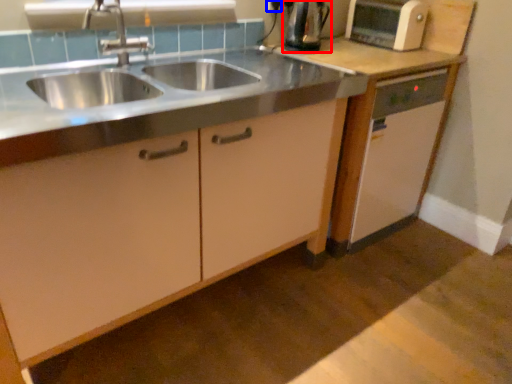
Question: Which point is further to the camera, kitchen appliance (highlighted by a red box) or electric outlet (highlighted by a blue box)?

Choices:
 (A) kitchen appliance
 (B) electric outlet

Answer: (B)